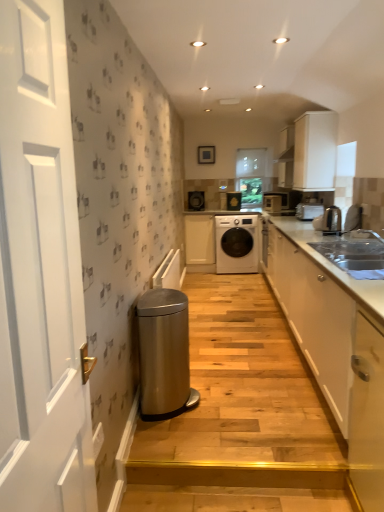
Question: Can you confirm if silver metallic sink at right is smaller than matte black speaker at center, which appears as the first appliance when viewed from the left?

Choices:
 (A) yes
 (B) no

Answer: (B)

Question: Is silver metallic sink at right wider than matte black speaker at center, the 4th appliance in the front-to-back sequence?

Choices:
 (A) yes
 (B) no

Answer: (A)

Question: Does silver metallic sink at right touch matte black speaker at center, the 4th appliance in the front-to-back sequence?

Choices:
 (A) yes
 (B) no

Answer: (B)

Question: From the image's perspective, is silver metallic sink at right beneath matte black speaker at center, which appears as the first appliance when viewed from the left?

Choices:
 (A) yes
 (B) no

Answer: (A)

Question: Is silver metallic sink at right to the right of matte black speaker at center, which appears as the 2th appliance when viewed from the back, from the viewer's perspective?

Choices:
 (A) no
 (B) yes

Answer: (B)

Question: Considering the relative sizes of silver metallic sink at right and matte black speaker at center, which appears as the first appliance when viewed from the left, in the image provided, is silver metallic sink at right thinner than matte black speaker at center, which appears as the first appliance when viewed from the left,?

Choices:
 (A) no
 (B) yes

Answer: (A)

Question: Considering the relative sizes of white glossy cabinet at right, which ranks as the second cabinetry in right-to-left order, and satin silver water heater at lower left in the image provided, is white glossy cabinet at right, which ranks as the second cabinetry in right-to-left order, thinner than satin silver water heater at lower left?

Choices:
 (A) yes
 (B) no

Answer: (B)

Question: Is white glossy cabinet at right, which is counted as the 3th cabinetry, starting from the left, completely or partially outside of satin silver water heater at lower left?

Choices:
 (A) yes
 (B) no

Answer: (A)

Question: Can you confirm if white glossy cabinet at right, the 3th cabinetry in the back-to-front sequence, is bigger than satin silver water heater at lower left?

Choices:
 (A) no
 (B) yes

Answer: (B)

Question: Considering the relative positions of white glossy cabinet at right, the 2th cabinetry viewed from the front, and satin silver water heater at lower left in the image provided, is white glossy cabinet at right, the 2th cabinetry viewed from the front, in front of satin silver water heater at lower left?

Choices:
 (A) yes
 (B) no

Answer: (A)

Question: Is the position of white glossy cabinet at right, the 2th cabinetry viewed from the front, more distant than that of satin silver water heater at lower left?

Choices:
 (A) yes
 (B) no

Answer: (B)

Question: Does white glossy cabinet at right, which ranks as the second cabinetry in right-to-left order, have a greater width compared to satin silver water heater at lower left?

Choices:
 (A) no
 (B) yes

Answer: (B)

Question: Is black glossy washing machine at center, the 2th appliance from the left, thinner than silver metallic sink at right?

Choices:
 (A) yes
 (B) no

Answer: (A)